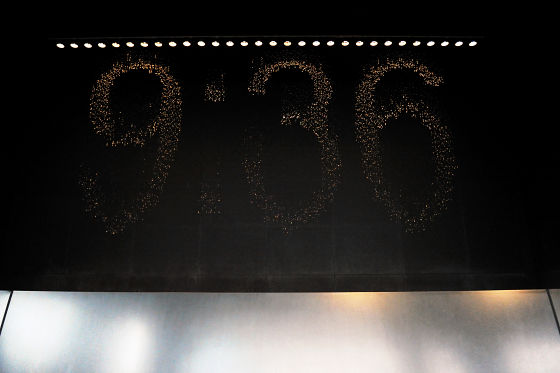
This screenshot has height=373, width=560. I want to click on light reflections, so pyautogui.click(x=109, y=353), pyautogui.click(x=265, y=344), pyautogui.click(x=522, y=354), pyautogui.click(x=437, y=358), pyautogui.click(x=375, y=307), pyautogui.click(x=483, y=297).